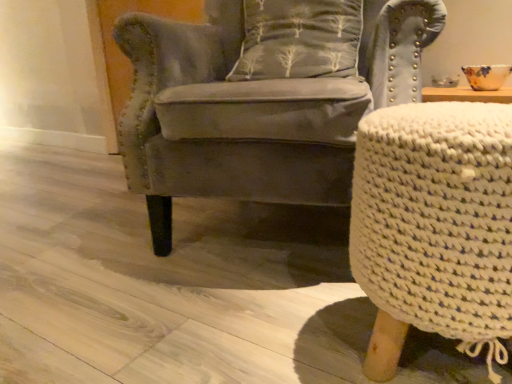
Question: Does velvet gray armchair at center have a greater width compared to gray fabric pillow with tree pattern at center?

Choices:
 (A) no
 (B) yes

Answer: (B)

Question: From a real-world perspective, is velvet gray armchair at center physically above gray fabric pillow with tree pattern at center?

Choices:
 (A) no
 (B) yes

Answer: (A)

Question: Is the depth of velvet gray armchair at center greater than that of gray fabric pillow with tree pattern at center?

Choices:
 (A) no
 (B) yes

Answer: (A)

Question: Is the position of velvet gray armchair at center less distant than that of gray fabric pillow with tree pattern at center?

Choices:
 (A) yes
 (B) no

Answer: (A)

Question: Is velvet gray armchair at center facing towards gray fabric pillow with tree pattern at center?

Choices:
 (A) no
 (B) yes

Answer: (A)

Question: Looking at their shapes, would you say white knitted stool at right is wider or thinner than velvet gray armchair at center?

Choices:
 (A) wide
 (B) thin

Answer: (B)

Question: Which is correct: white knitted stool at right is inside velvet gray armchair at center, or outside of it?

Choices:
 (A) outside
 (B) inside

Answer: (A)

Question: From a real-world perspective, relative to velvet gray armchair at center, is white knitted stool at right vertically above or below?

Choices:
 (A) above
 (B) below

Answer: (B)

Question: In the image, is white knitted stool at right positioned in front of or behind velvet gray armchair at center?

Choices:
 (A) front
 (B) behind

Answer: (A)

Question: Is point (269, 38) positioned closer to the camera than point (396, 127)?

Choices:
 (A) closer
 (B) farther

Answer: (B)

Question: From their relative heights in the image, would you say gray fabric pillow with tree pattern at center is taller or shorter than white knitted stool at right?

Choices:
 (A) short
 (B) tall

Answer: (A)

Question: In terms of size, does gray fabric pillow with tree pattern at center appear bigger or smaller than white knitted stool at right?

Choices:
 (A) small
 (B) big

Answer: (A)

Question: Is gray fabric pillow with tree pattern at center situated inside white knitted stool at right or outside?

Choices:
 (A) inside
 (B) outside

Answer: (B)

Question: Is white knitted stool at right wider or thinner than gray fabric pillow with tree pattern at center?

Choices:
 (A) wide
 (B) thin

Answer: (A)

Question: In terms of size, does white knitted stool at right appear bigger or smaller than gray fabric pillow with tree pattern at center?

Choices:
 (A) small
 (B) big

Answer: (B)